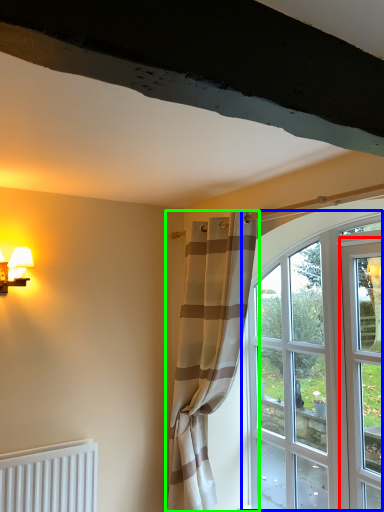
Question: Which object is positioned farthest from screen door (highlighted by a red box)? Select from window (highlighted by a blue box) and curtain (highlighted by a green box).

Choices:
 (A) window
 (B) curtain

Answer: (B)